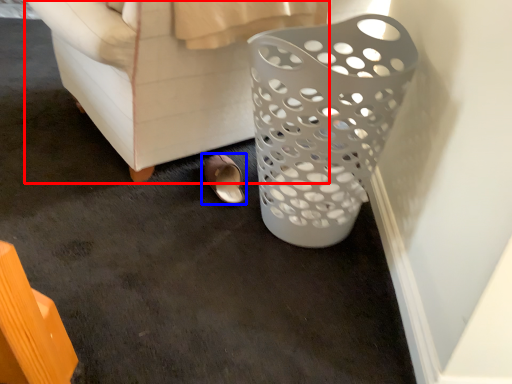
Question: Which object is further to the camera taking this photo, furniture (highlighted by a red box) or footwear (highlighted by a blue box)?

Choices:
 (A) furniture
 (B) footwear

Answer: (B)